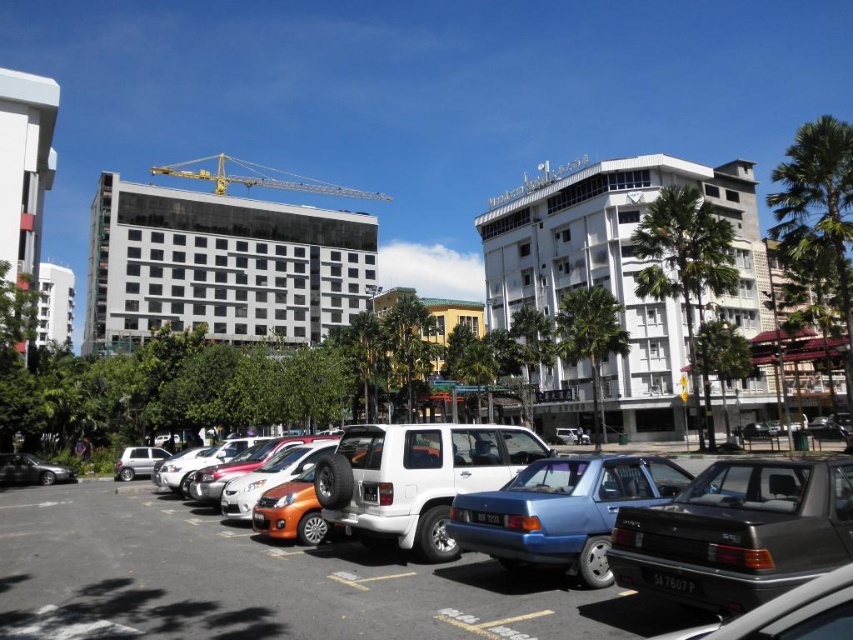
You are standing in the parking lot and want to take a photo of the glassy reflective building at center without including the shiny silver car at lower left in the frame. Which direction should you move to ensure the car is out of the shot?

The glassy reflective building at center is positioned on the left side of the shiny silver car at lower left. To avoid including the car in your photo, move to the right side of the shiny silver car at lower left so that the car is no longer in the frame.

Looking at this image, you are standing in the parking lot and want to take a photo of both the under construction building and the traditional building. You notice two points marked in the image at coordinates point [115,292] and point [691,545]. Which point should you stand at to ensure both buildings are in your camera frame?

You should stand at point [115,292] because it is closer to the camera, allowing you to capture both the under construction building and the traditional building in your frame.

You are a city planner assessing the parking lot. You need to determine if the yellow metallic crane at upper center can fit into a space designated for the shiny silver car at lower left. Based on their widths, will it fit?

The yellow metallic crane at upper center is wider than the shiny silver car at lower left, so it cannot fit into the space designated for the shiny silver car at lower left.